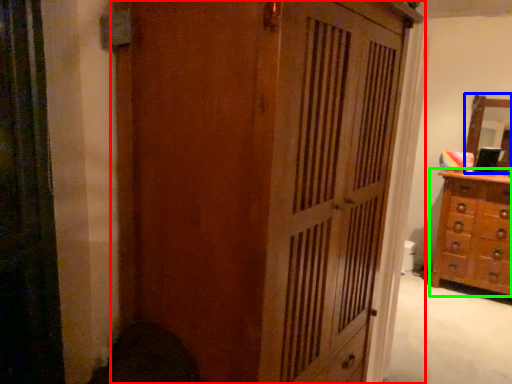
Question: Considering the real-world distances, which object is closest to cupboard (highlighted by a red box)? mirror (highlighted by a blue box) or chest of drawers (highlighted by a green box).

Choices:
 (A) mirror
 (B) chest of drawers

Answer: (B)